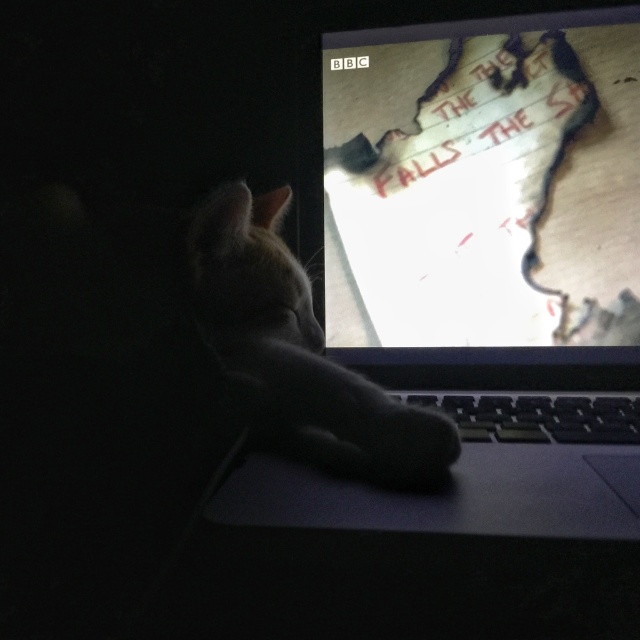
You are a delivery robot that needs to place a small package between the slate gray laptop at center and the white fur cat at center. The package is 15 centimeters long. Can you fit it there?

The slate gray laptop at center and white fur cat at center are 17.39 centimeters apart. Since the package is 15 centimeters long, it can fit between them with 2.39 centimeters of space remaining.

You are an assistant who needs to determine the spatial relationship between the white paper at center and the black fuzzy paw at lower center. Based on the scene, which object is taller?

The white paper at center is taller than the black fuzzy paw at lower center.

You are holding a camera and want to take a photo of the scene described. The camera is currently positioned at point (568, 273). To ensure the cat and laptop are both clearly visible, should you move the camera closer or farther away from the scene?

The camera is currently 37.26 inches away from point (568, 273). To ensure both the cat and laptop are clearly visible, you should consider the camera position. Since the cat is on the left and the laptop is central, moving closer might allow capturing details, but could exclude parts. Moving farther might include the whole scene but reduce detail. However, the given distance is 37.26 inches. If this is within the camera lens focal range for clarity, no move is needed. If not, adjust accordingly. But the